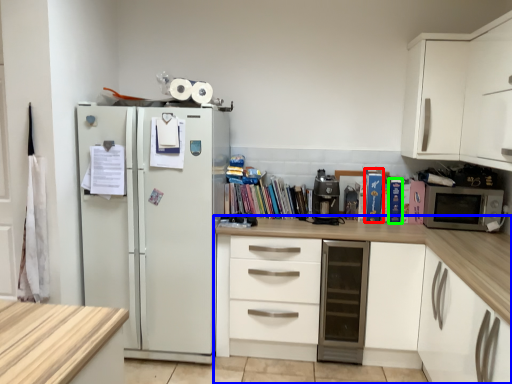
Question: Which is farther away from paperback book (highlighted by a red box)? cabinetry (highlighted by a blue box) or paperback book (highlighted by a green box)?

Choices:
 (A) cabinetry
 (B) paperback book

Answer: (A)